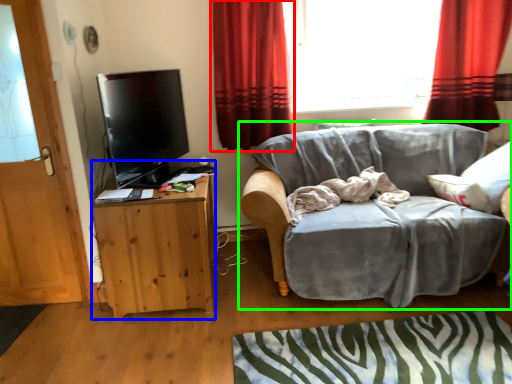
Question: Considering the real-world distances, which object is closest to curtain (highlighted by a red box)? cabinetry (highlighted by a blue box) or studio couch (highlighted by a green box).

Choices:
 (A) cabinetry
 (B) studio couch

Answer: (A)